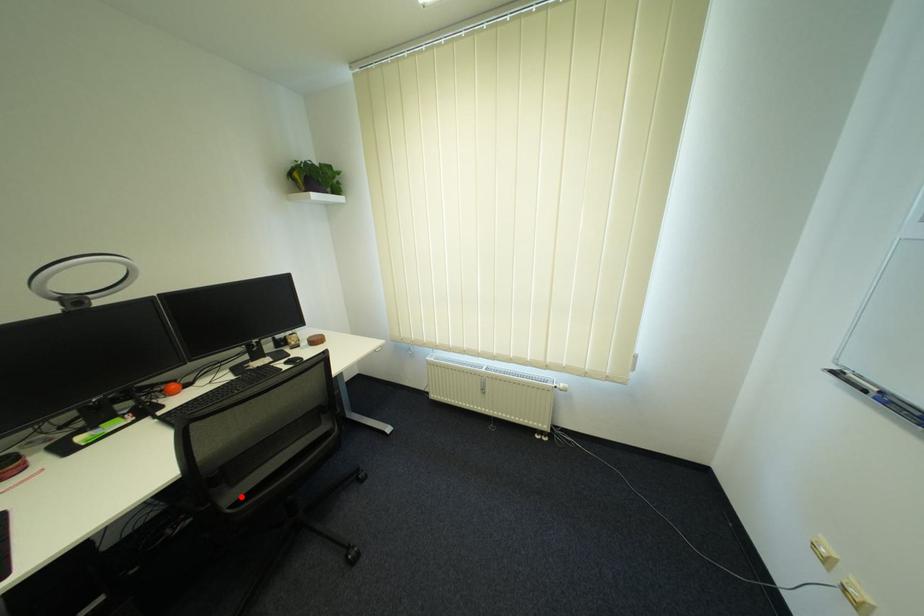
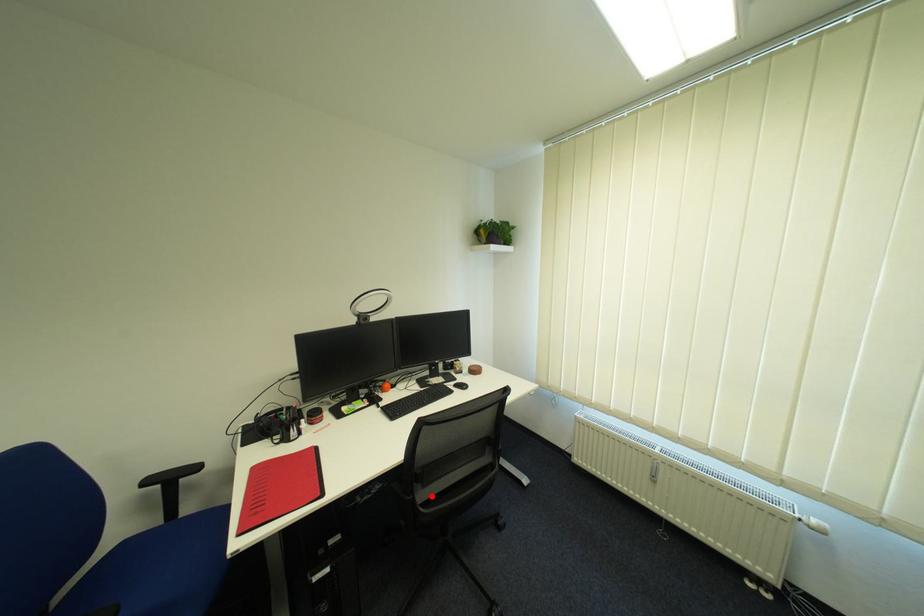
I am providing you with two images of the same scene from different viewpoints. A red point is marked on the first image and another point is marked on the second image. Does the point marked in image1 correspond to the same location as the one in image2?

Yes